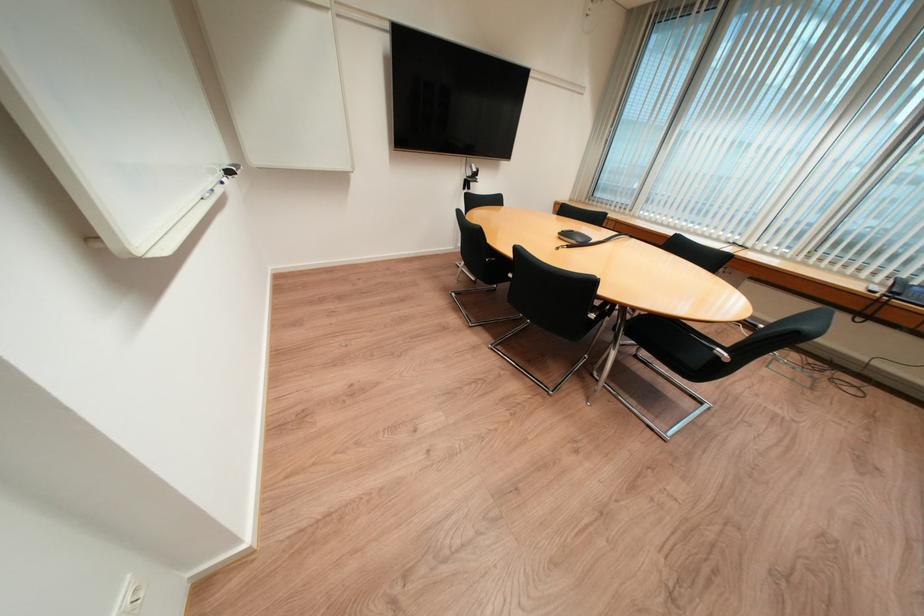
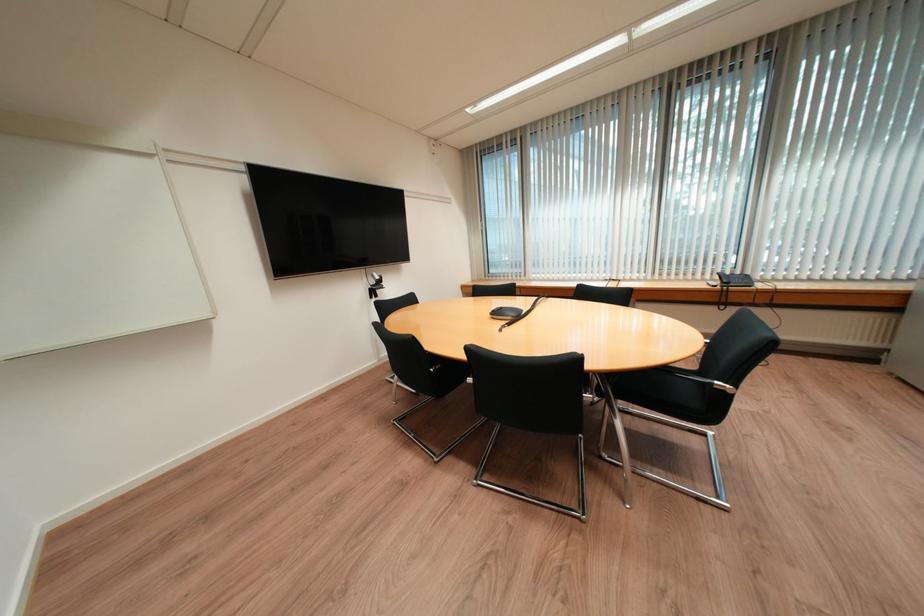
First-person continuous shooting, in which direction is the camera rotating?

The camera rotated toward right-up.